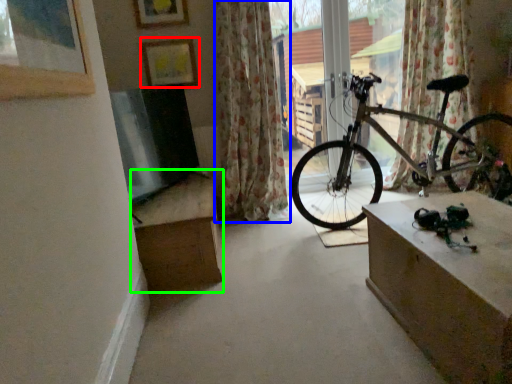
Question: Considering the real-world distances, which object is closest to picture frame (highlighted by a red box)? curtain (highlighted by a blue box) or cardboard box (highlighted by a green box).

Choices:
 (A) curtain
 (B) cardboard box

Answer: (A)